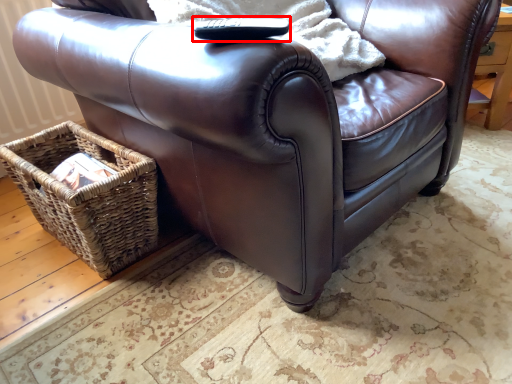
Question: From the image's perspective, what is the correct spatial relationship of remote (annotated by the red box) in relation to picnic basket?

Choices:
 (A) below
 (B) above

Answer: (B)